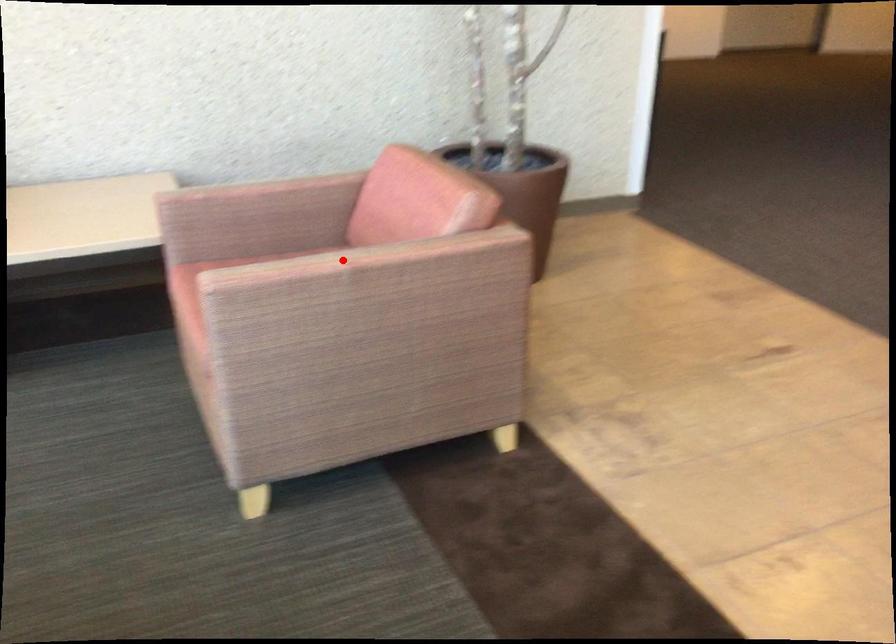
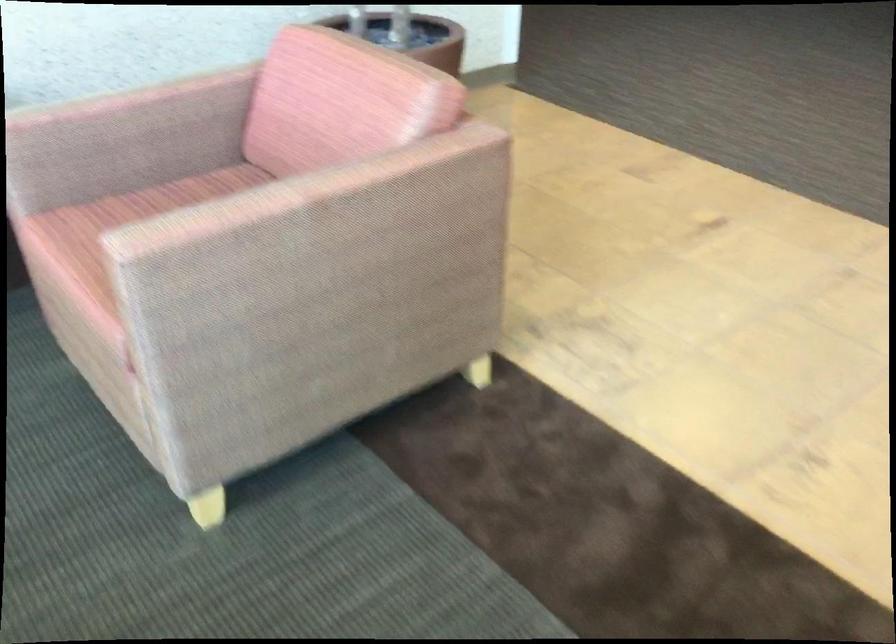
Question: I am providing you with two images of the same scene from different viewpoints. In image1, a red point is highlighted. Considering the same 3D point in image2, which of the following is correct?

Choices:
 (A) It is closer
 (B) It is farther

Answer: (A)